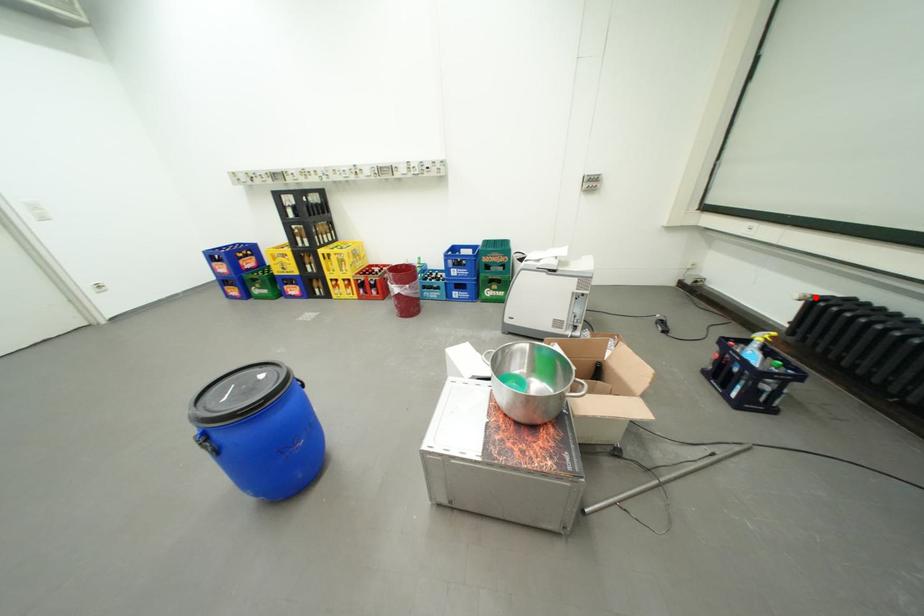
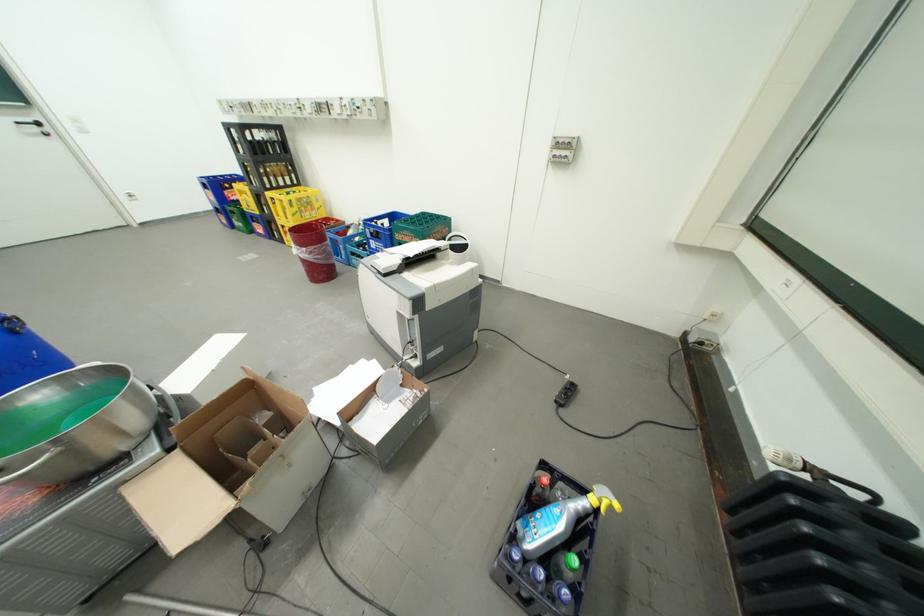
In the second image, find the point that corresponds to the highlighted location in the first image.

(800, 461)